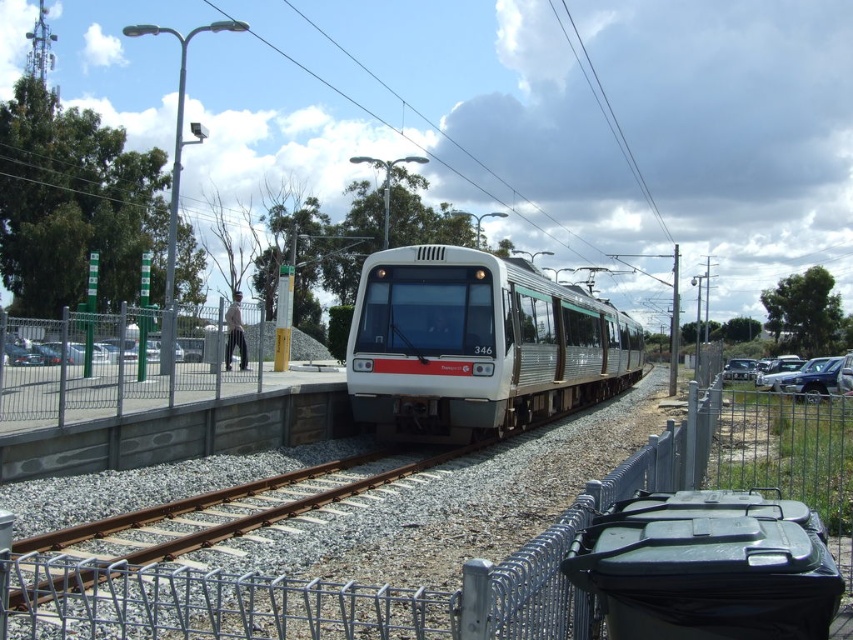
You are a maintenance worker inspecting the railway tracks. You notice the white glossy train at center is currently positioned over the rusty metal train track at center. Can you confirm if the train is directly on top of the track?

The white glossy train at center is above rusty metal train track at center, so yes, the train is directly on top of the track.

You are a pedestrian standing on the platform waiting for the light rail train. You notice the rusty metal train track at center and the metallic silver car at right. Which object is positioned higher relative to the other?

The rusty metal train track at center is located above the metallic silver car at right.

From the picture: You are standing at the origin point of the image. Where is the rusty metal train track at center located?

The rusty metal train track at center is located at point [207,518].